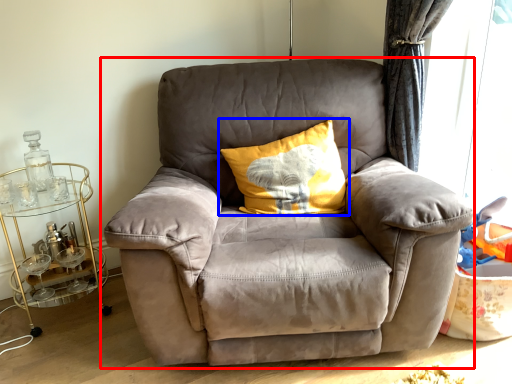
Question: Which of the following is the farthest to the observer, chair (highlighted by a red box) or pillow (highlighted by a blue box)?

Choices:
 (A) chair
 (B) pillow

Answer: (B)